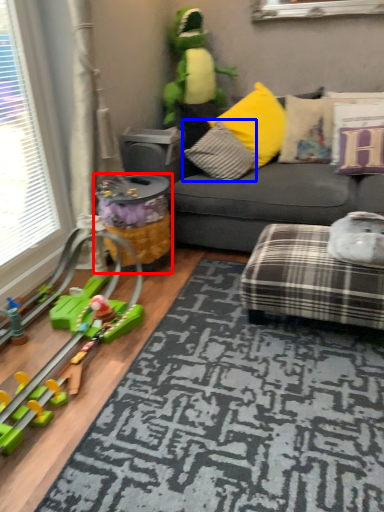
Question: Among these objects, which one is nearest to the camera, toy (highlighted by a red box) or pillow (highlighted by a blue box)?

Choices:
 (A) toy
 (B) pillow

Answer: (A)